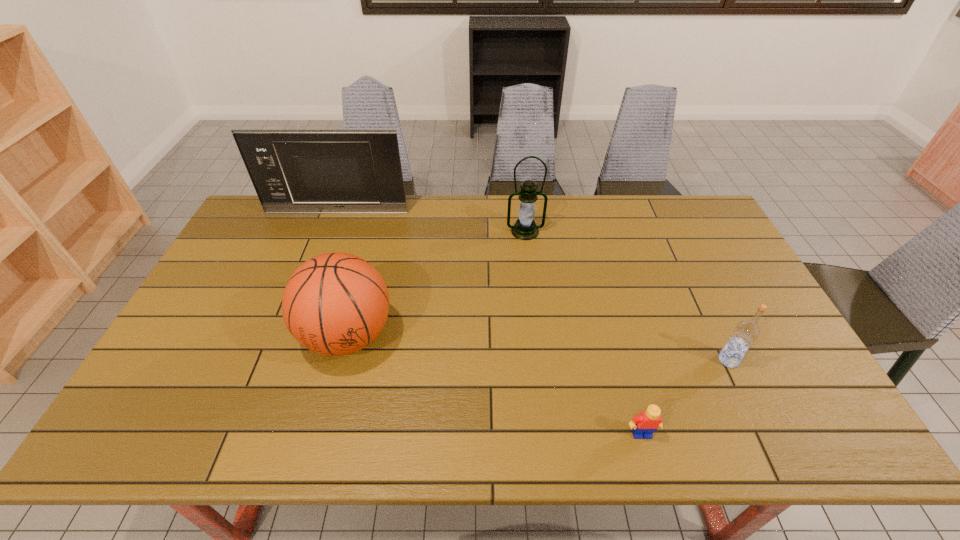
The width and height of the screenshot is (960, 540). Find the location of `the farthest object`. the farthest object is located at coordinates (293, 171).

Where is `the fourth nearest object`? This screenshot has height=540, width=960. the fourth nearest object is located at coordinates (525, 228).

Locate an element on the screen. This screenshot has height=540, width=960. the third object from right to left is located at coordinates (525, 228).

The height and width of the screenshot is (540, 960). Identify the location of basketball. (335, 304).

Image resolution: width=960 pixels, height=540 pixels. In order to click on the second shortest object in this screenshot , I will do `click(746, 332)`.

The height and width of the screenshot is (540, 960). I want to click on vodka, so click(x=746, y=332).

At what (x,y) coordinates should I click in order to perform the action: click on the shortest object. Please return your answer as a coordinate pair (x, y). This screenshot has height=540, width=960. Looking at the image, I should click on (643, 425).

The width and height of the screenshot is (960, 540). Find the location of `the second object from right to left`. the second object from right to left is located at coordinates (643, 425).

Identify the location of vacant area situated on the front panel of the farthest object. This screenshot has width=960, height=540. (317, 266).

At what (x,y) coordinates should I click in order to perform the action: click on vacant space located 0.180m on the side where the fourth nearest object emits light. Please return your answer as a coordinate pair (x, y). This screenshot has height=540, width=960. Looking at the image, I should click on (531, 279).